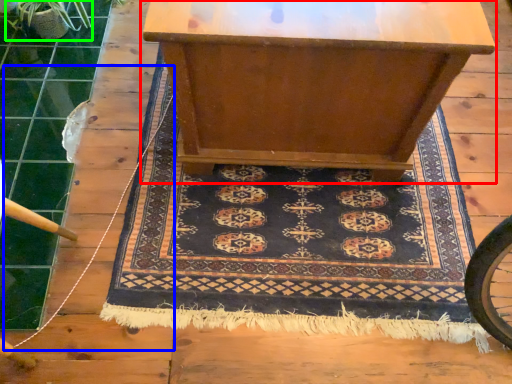
Question: Which object is positioned farthest from table (highlighted by a red box)? Select from string (highlighted by a blue box) and plant (highlighted by a green box).

Choices:
 (A) string
 (B) plant

Answer: (B)